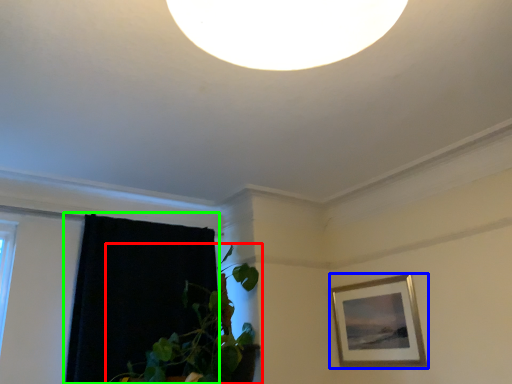
Question: Estimate the real-world distances between objects in this image. Which object is closer to houseplant (highlighted by a red box), picture frame (highlighted by a blue box) or curtain (highlighted by a green box)?

Choices:
 (A) picture frame
 (B) curtain

Answer: (B)